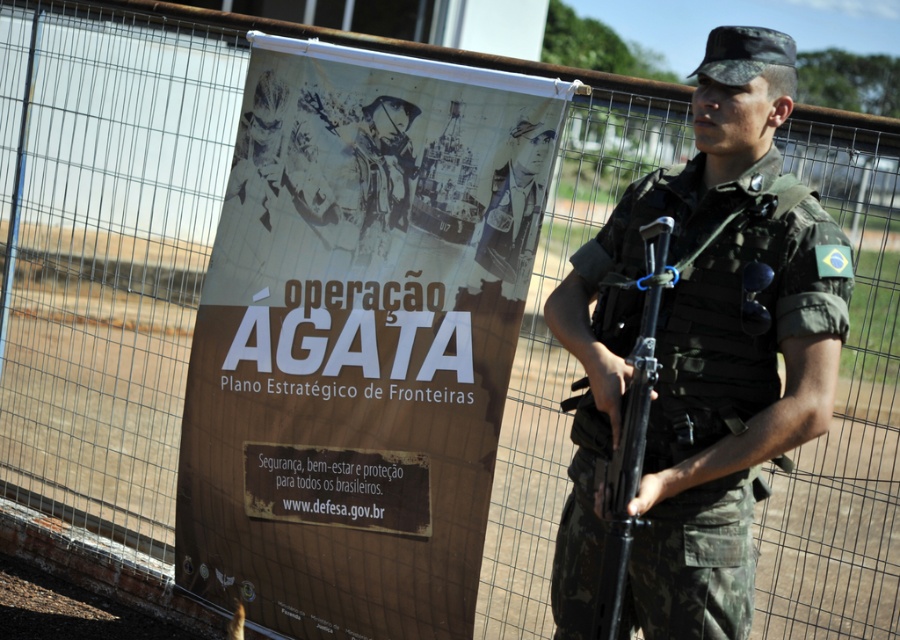
Does camouflage uniform at center have a greater width compared to camouflage-patterned rifle at center?

Yes.

Looking at this image, which is below, camouflage uniform at center or camouflage-patterned rifle at center?

camouflage-patterned rifle at center is lower down.

Who is more distant from viewer, (734, 588) or (622, 497)?

The point (734, 588) is behind.

The width and height of the screenshot is (900, 640). In order to click on camouflage uniform at center in this screenshot , I will do `click(702, 355)`.

Image resolution: width=900 pixels, height=640 pixels. What are the coordinates of `brown paper poster at center` in the screenshot? It's located at (360, 339).

Which is below, brown paper poster at center or camouflage-patterned rifle at center?

Positioned lower is camouflage-patterned rifle at center.

Is point (351, 88) farther from viewer compared to point (621, 467)?

Yes, point (351, 88) is farther from viewer.

The height and width of the screenshot is (640, 900). Identify the location of brown paper poster at center. (360, 339).

Who is more forward, (297,586) or (762,342)?

Point (762,342)

Where is `brown paper poster at center`? brown paper poster at center is located at coordinates (360, 339).